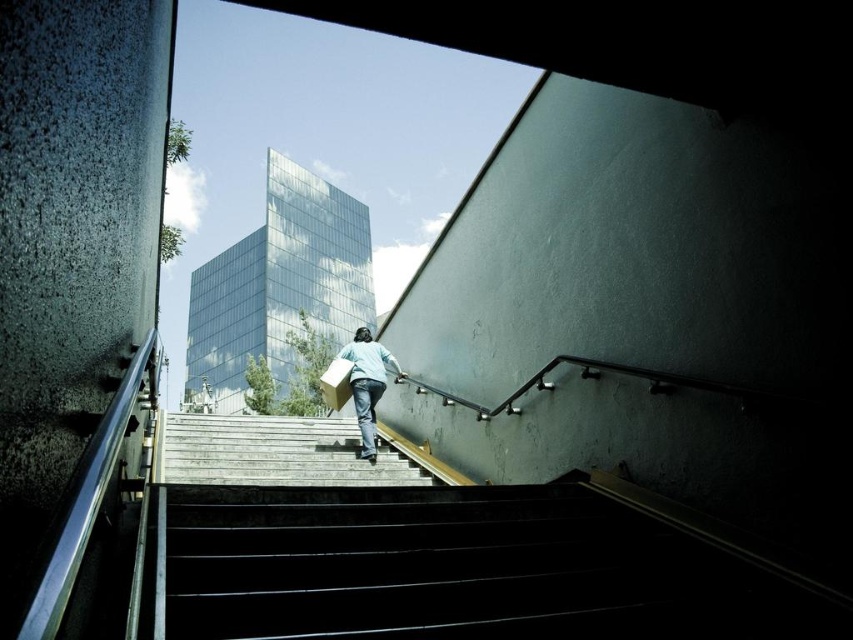
You are standing at the top of the staircase and want to place a small decorative item on the wooden stairs at center and the light blue fabric at center. Which surface can accommodate a larger item?

The wooden stairs at center is larger in size than the light blue fabric at center, so the wooden stairs at center can accommodate a larger item.

From the picture: You are standing at the top of the staircase and need to hand a small package to the person ascending the stairs. The package is in your hand, and you want to ensure it reaches them safely. Considering the distance between the wooden stairs at center and the light blue fabric at center, can you throw the package directly to them without it hitting any part of the staircase?

The wooden stairs at center is 1.06 meters away from the light blue fabric at center. Since the distance is relatively short and there are no obstacles mentioned between them, you can safely throw the package directly to the person without it hitting any part of the staircase.

You are standing at the top of the staircase and want to reach the person ascending the steps. You notice two points marked on the steps. Which point, point (238, 419) or point (358, 342), is closer to you?

Point (238, 419) is closer to you because it is further to the viewer than point (358, 342).